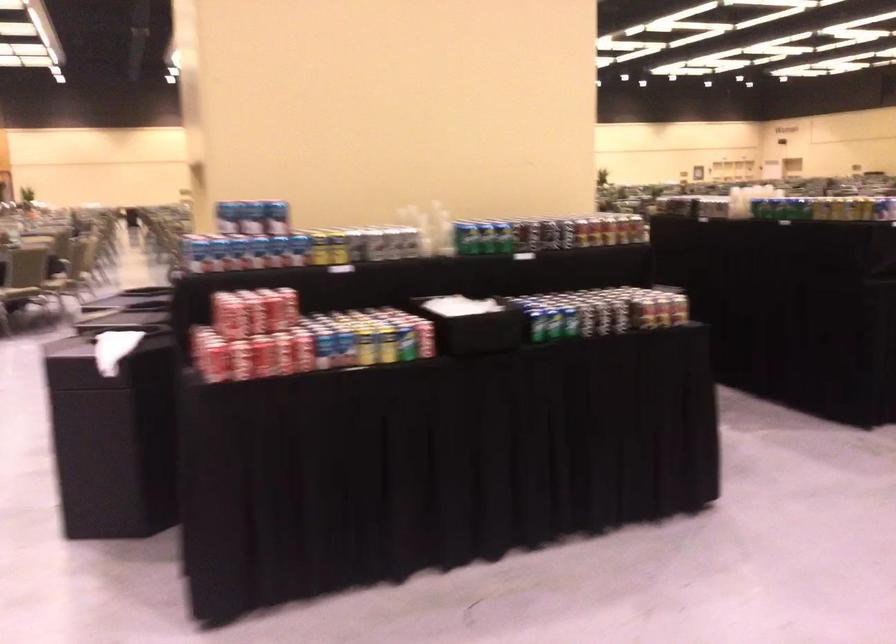
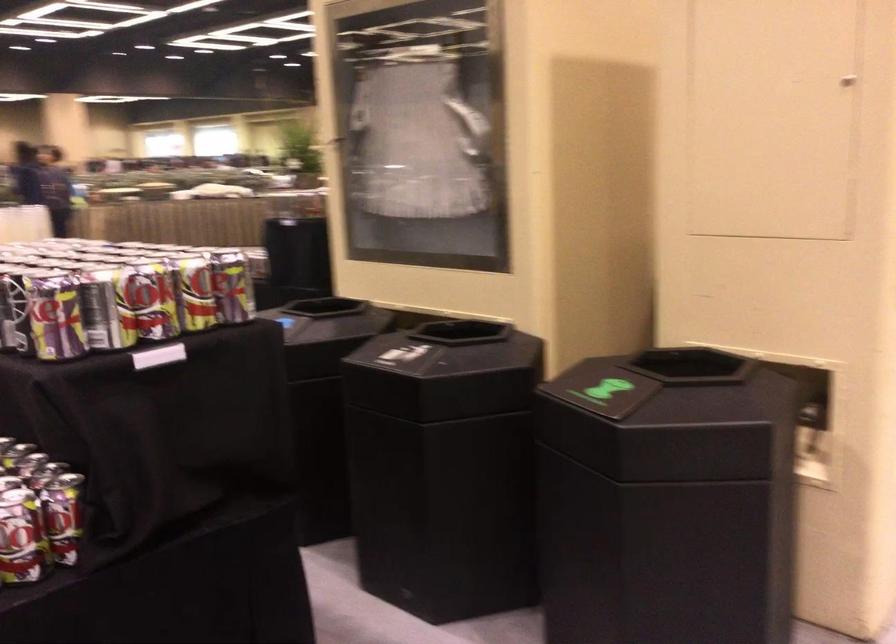
Question: I am providing you with two images of the same scene from different viewpoints. Which of the following objects are not visible in image2?

Choices:
 (A) beverage can
 (B) red soda can
 (C) black music stand
 (D) black bin opening

Answer: (B)